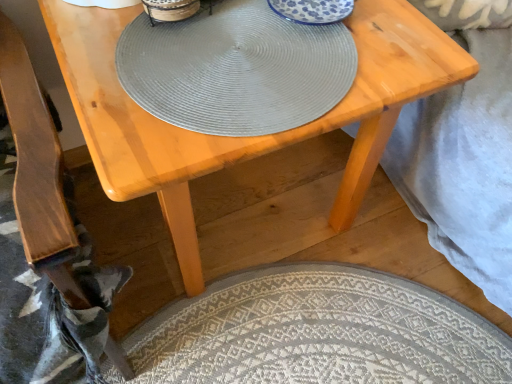
I want to click on vacant area situated below matte gray placemat at center (from a real-world perspective), so click(236, 61).